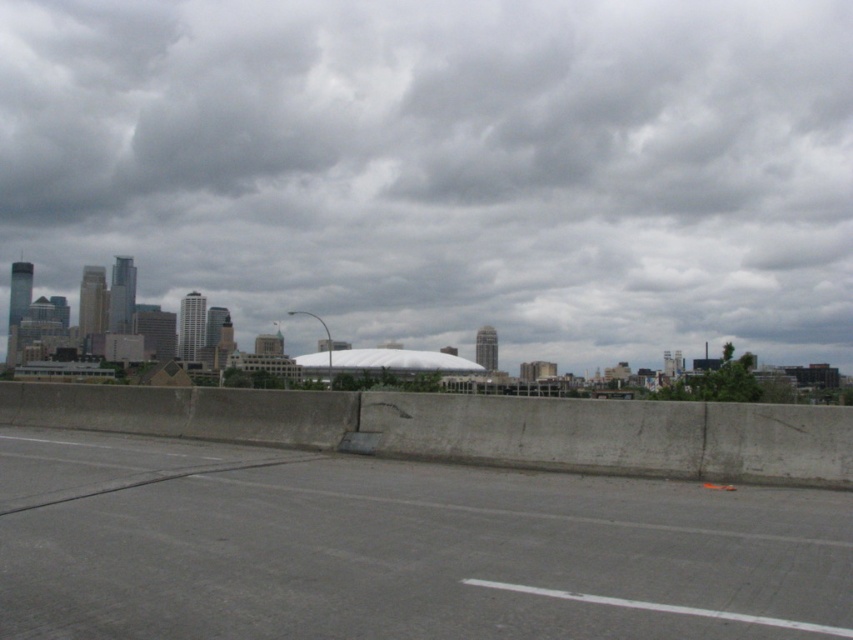
You are standing on the gray concrete highway at lower center and looking towards the gray cloudy sky at upper center. Which object is closer to your eyes?

The gray concrete highway at lower center is closer to your eyes because it is positioned lower in the image, while the gray cloudy sky at upper center is further away.

You are a drone operator planning to capture aerial footage of the gray cloudy sky at upper center and the gray concrete highway at lower center. Since you need to adjust the camera angle to focus on both objects, which object requires a wider angle to capture its entirety?

The gray cloudy sky at upper center requires a wider angle to capture its entirety because it is bigger than the gray concrete highway at lower center.

You are standing on the concrete barrier in the foreground of the urban landscape. Looking up, you notice a point marked at coordinates (445, 168). What does this point indicate?

The point at (445, 168) indicates the gray cloudy sky at upper center.